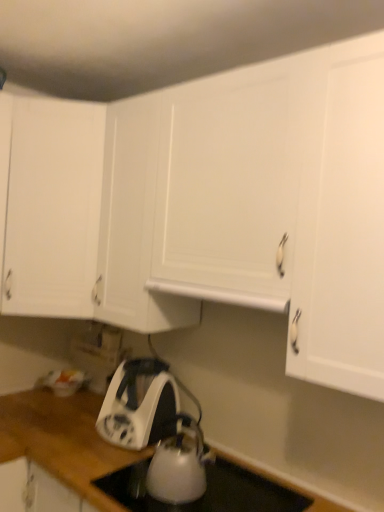
Where is `vacant space to the right of white glossy kettle at lower center`? The width and height of the screenshot is (384, 512). vacant space to the right of white glossy kettle at lower center is located at coordinates (241, 493).